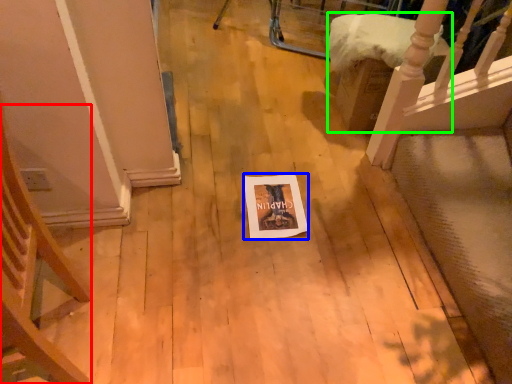
Question: Considering the real-world distances, which object is closest to armchair (highlighted by a red box)? postcard (highlighted by a blue box) or furniture (highlighted by a green box).

Choices:
 (A) postcard
 (B) furniture

Answer: (A)